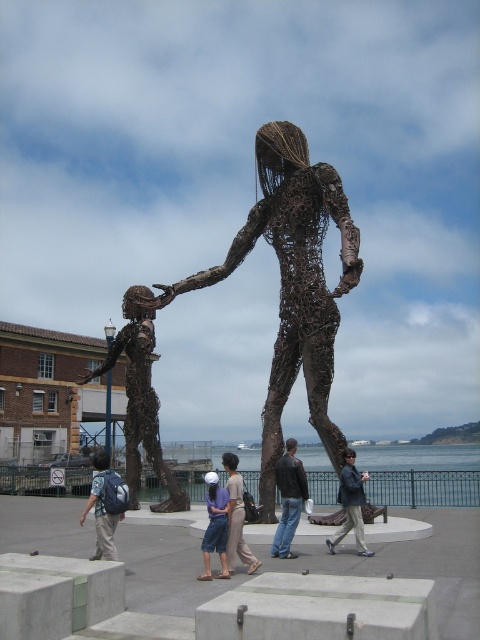
Question: Which point is farther to the camera?

Choices:
 (A) (115, 352)
 (B) (227, 552)

Answer: (A)

Question: Is the position of denim shorts at center less distant than that of denim pants at center?

Choices:
 (A) no
 (B) yes

Answer: (B)

Question: Can you confirm if leather jacket at center is positioned to the right of dark brown leather jacket at center?

Choices:
 (A) no
 (B) yes

Answer: (A)

Question: Based on their relative distances, which object is nearer to the dark brown leather jacket at center?

Choices:
 (A) bronze wireframe figure at center
 (B) denim shorts at center
 (C) denim pants at center
 (D) brown wire sculpture at left

Answer: (C)

Question: Is brown wire sculpture at left above denim shorts at center?

Choices:
 (A) no
 (B) yes

Answer: (A)

Question: Which of these objects is positioned closest to the denim shorts at center?

Choices:
 (A) brown wire sculpture at left
 (B) dark brown leather jacket at center
 (C) bronze wireframe figure at center
 (D) denim pants at center

Answer: (D)